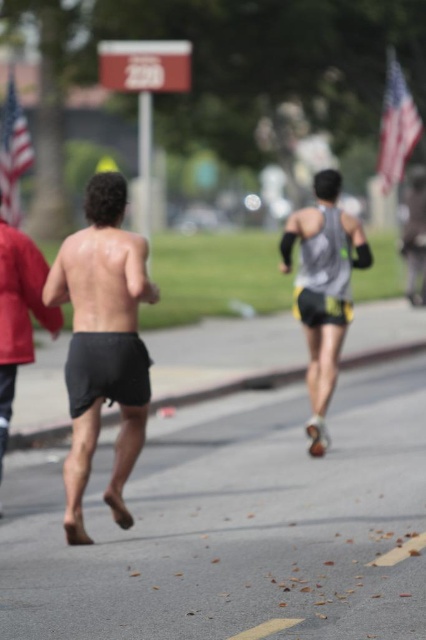
Question: Which point appears closest to the camera in this image?

Choices:
 (A) (8, 358)
 (B) (9, 81)
 (C) (118, 358)
 (D) (411, 150)

Answer: (C)

Question: Which point is closer to the camera taking this photo?

Choices:
 (A) (408, 106)
 (B) (317, 218)
 (C) (140, 356)
 (D) (9, 186)

Answer: (C)

Question: Which of the following is the farthest from the observer?

Choices:
 (A) black matte shorts at left
 (B) black cotton shorts at center

Answer: (A)

Question: Is american flag at upper right smaller than american flag at left?

Choices:
 (A) no
 (B) yes

Answer: (B)

Question: Can you confirm if black cotton shorts at center is bigger than american flag at left?

Choices:
 (A) no
 (B) yes

Answer: (A)

Question: Is black matte shorts at center bigger than gray matte running suit at center?

Choices:
 (A) yes
 (B) no

Answer: (B)